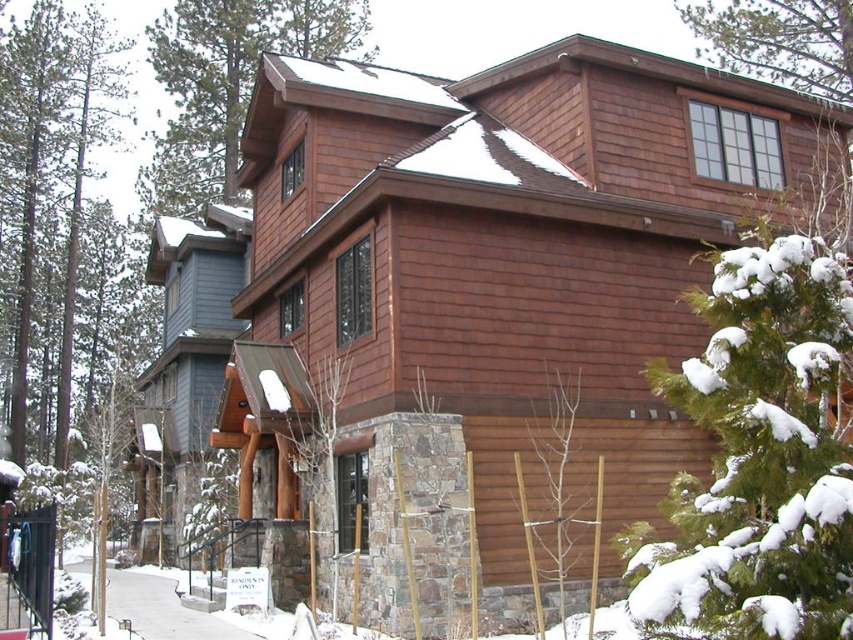
Question: Does green textured pine tree at upper center have a lesser width compared to green textured pine tree at upper right?

Choices:
 (A) no
 (B) yes

Answer: (A)

Question: Is green coniferous tree at left behind bare wood tree at center?

Choices:
 (A) yes
 (B) no

Answer: (A)

Question: Does green textured pine tree at upper right appear under bare wood tree at center?

Choices:
 (A) no
 (B) yes

Answer: (A)

Question: Which object is the farthest from the bare wood tree at center?

Choices:
 (A) green textured pine tree at upper center
 (B) green coniferous tree at left

Answer: (B)

Question: Which of these objects is positioned farthest from the green coniferous tree at left?

Choices:
 (A) bare wood tree at center
 (B) green textured pine tree at upper right

Answer: (A)

Question: Which of the following is the farthest from the observer?

Choices:
 (A) green textured pine tree at upper right
 (B) green coniferous tree at left
 (C) green textured pine tree at upper center
 (D) bare wood tree at center

Answer: (C)